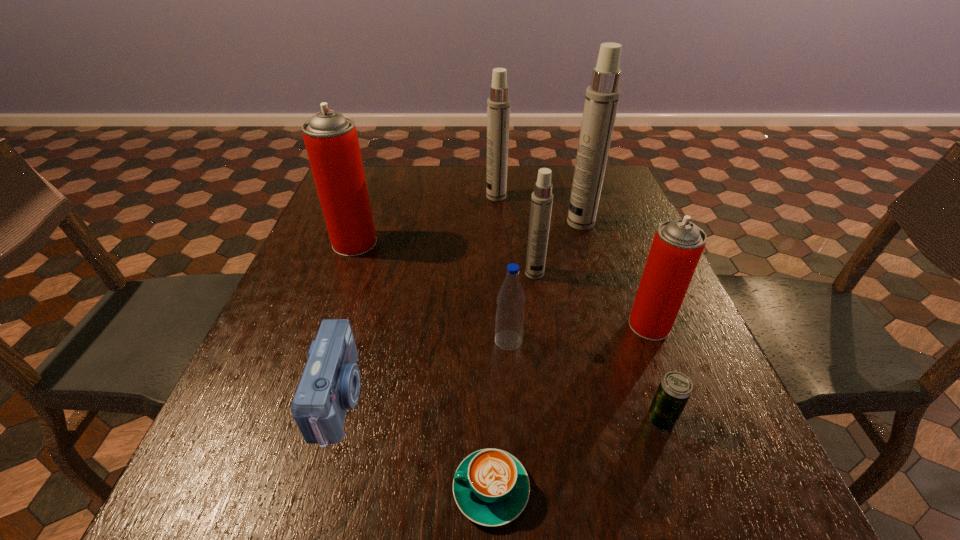
Image resolution: width=960 pixels, height=540 pixels. I want to click on free space located on the front of the third aerosol can from left to right, so [x=553, y=402].

Where is `vacant position located on the back of the sixth tallest object`? This screenshot has width=960, height=540. vacant position located on the back of the sixth tallest object is located at coordinates tap(502, 239).

The height and width of the screenshot is (540, 960). In order to click on vacant space located 0.050m on the lens of the camera in this screenshot , I will do `click(388, 399)`.

This screenshot has height=540, width=960. Find the location of `free region located on the back of the beer can`. free region located on the back of the beer can is located at coordinates point(623,310).

The image size is (960, 540). Find the location of `vacant area situated 0.190m with the handle on the right side of the nearest object`. vacant area situated 0.190m with the handle on the right side of the nearest object is located at coordinates pos(328,489).

Find the location of a particular element. Image resolution: width=960 pixels, height=540 pixels. vacant space located with the handle on the right side of the nearest object is located at coordinates (229, 489).

This screenshot has height=540, width=960. Identify the location of vacant space located with the handle on the right side of the nearest object. (269, 489).

The height and width of the screenshot is (540, 960). Find the location of `object at the far edge`. object at the far edge is located at coordinates (498, 104).

Find the location of a particular element. This screenshot has height=540, width=960. object positioned at the near edge is located at coordinates (491, 487).

Locate an element on the screen. This screenshot has height=540, width=960. aerosol can located in the left edge section of the desktop is located at coordinates (331, 140).